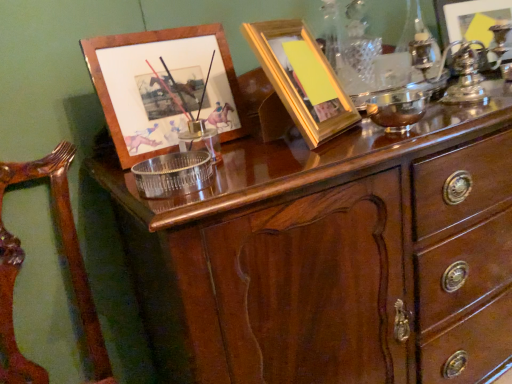
The image size is (512, 384). Describe the element at coordinates (470, 19) in the screenshot. I see `metallic silver picture frame at upper right, which is counted as the 1th picture frame, starting from the back` at that location.

Measure the distance between mahogany wood chest of drawers at upper center and camera.

21.05 inches.

Identify the location of wooden picture frame at upper left, positioned as the 1th picture frame in left-to-right order. The width and height of the screenshot is (512, 384). (163, 87).

What is the approximate height of wooden picture frame at upper left, positioned as the 1th picture frame in left-to-right order?

wooden picture frame at upper left, positioned as the 1th picture frame in left-to-right order, is 9.59 inches in height.

What do you see at coordinates (67, 265) in the screenshot? I see `wooden armchair at left` at bounding box center [67, 265].

You are a GUI agent. You are given a task and a screenshot of the screen. Output one action in this format:
    pyautogui.click(x=<x>, y=<y>)
    Task: Click on the metallic silver picture frame at upper right, acting as the 3th picture frame starting from the left
    
    Given the screenshot: What is the action you would take?
    pyautogui.click(x=470, y=19)

Is wooden picture frame at upper left, which appears as the 2th picture frame when viewed from the back, far away from yellow matte picture frame at upper center, which is counted as the second picture frame, starting from the left?

No, wooden picture frame at upper left, which appears as the 2th picture frame when viewed from the back, is not far away from yellow matte picture frame at upper center, which is counted as the second picture frame, starting from the left.

Can you confirm if wooden picture frame at upper left, which appears as the 2th picture frame when viewed from the back, is bigger than yellow matte picture frame at upper center, which is the 3th picture frame from back to front?

No.

Considering the positions of point (220, 35) and point (296, 96), is point (220, 35) closer or farther from the camera than point (296, 96)?

Point (220, 35) is farther from the camera than point (296, 96).

I want to click on picture frame on the left side of yellow matte picture frame at upper center, which is the 3th picture frame from back to front, so click(163, 87).

Considering the positions of objects yellow matte picture frame at upper center, which is the 3th picture frame from back to front, and mahogany wood chest of drawers at upper center in the image provided, who is more to the left, yellow matte picture frame at upper center, which is the 3th picture frame from back to front, or mahogany wood chest of drawers at upper center?

From the viewer's perspective, yellow matte picture frame at upper center, which is the 3th picture frame from back to front, appears more on the left side.

From the image's perspective, is yellow matte picture frame at upper center, which is the 3th picture frame from back to front, located above or below mahogany wood chest of drawers at upper center?

Based on their image positions, yellow matte picture frame at upper center, which is the 3th picture frame from back to front, is located above mahogany wood chest of drawers at upper center.

From a real-world perspective, is yellow matte picture frame at upper center, the 1th picture frame when ordered from front to back, on mahogany wood chest of drawers at upper center?

Yes, from a real-world perspective, yellow matte picture frame at upper center, the 1th picture frame when ordered from front to back, is on top of mahogany wood chest of drawers at upper center.

Can you confirm if yellow matte picture frame at upper center, the 2th picture frame from the right, is taller than mahogany wood chest of drawers at upper center?

No.

Does point (6, 320) come behind point (315, 41)?

No.

In the scene shown: Is wooden armchair at left placed right next to yellow matte picture frame at upper center, which is the 3th picture frame from back to front?

They are not placed beside each other.

From the image's perspective, is wooden armchair at left located beneath yellow matte picture frame at upper center, which is the 3th picture frame from back to front?

Yes, from the image's perspective, wooden armchair at left is beneath yellow matte picture frame at upper center, which is the 3th picture frame from back to front.

Is wooden picture frame at upper left, which appears as the third picture frame when viewed from the right, oriented away from wooden armchair at left?

That's not correct — wooden picture frame at upper left, which appears as the third picture frame when viewed from the right, is not looking away from wooden armchair at left.

Is wooden picture frame at upper left, which appears as the third picture frame when viewed from the right, positioned far away from wooden armchair at left?

No, wooden picture frame at upper left, which appears as the third picture frame when viewed from the right, is in close proximity to wooden armchair at left.

Where is `picture frame that is the 1st one when counting upward from the wooden armchair at left (from the image's perspective)`? This screenshot has height=384, width=512. picture frame that is the 1st one when counting upward from the wooden armchair at left (from the image's perspective) is located at coordinates (163, 87).

Does wooden armchair at left turn towards metallic silver picture frame at upper right, positioned as the third picture frame in front-to-back order?

No, wooden armchair at left is not turned towards metallic silver picture frame at upper right, positioned as the third picture frame in front-to-back order.

Which object is more forward, wooden armchair at left or metallic silver picture frame at upper right, the 1th picture frame viewed from the right?

wooden armchair at left.

Is wooden armchair at left at the left side of metallic silver picture frame at upper right, acting as the 3th picture frame starting from the left?

Correct, you'll find wooden armchair at left to the left of metallic silver picture frame at upper right, acting as the 3th picture frame starting from the left.

From the image's perspective, is wooden armchair at left positioned above or below metallic silver picture frame at upper right, acting as the 3th picture frame starting from the left?

Based on their image positions, wooden armchair at left is located beneath metallic silver picture frame at upper right, acting as the 3th picture frame starting from the left.

From the image's perspective, would you say metallic silver picture frame at upper right, positioned as the third picture frame in front-to-back order, is positioned over wooden armchair at left?

Yes, from the image's perspective, metallic silver picture frame at upper right, positioned as the third picture frame in front-to-back order, is over wooden armchair at left.

Would you consider metallic silver picture frame at upper right, acting as the 3th picture frame starting from the left, to be distant from wooden armchair at left?

metallic silver picture frame at upper right, acting as the 3th picture frame starting from the left, is far away from wooden armchair at left.

Which of these two, metallic silver picture frame at upper right, which is counted as the 1th picture frame, starting from the back, or wooden armchair at left, is thinner?

metallic silver picture frame at upper right, which is counted as the 1th picture frame, starting from the back, is thinner.

Is metallic silver picture frame at upper right, acting as the 3th picture frame starting from the left, taller than wooden armchair at left?

Incorrect, the height of metallic silver picture frame at upper right, acting as the 3th picture frame starting from the left, is not larger of that of wooden armchair at left.

Is yellow matte picture frame at upper center, the 2th picture frame from the right, in contact with wooden armchair at left?

yellow matte picture frame at upper center, the 2th picture frame from the right, and wooden armchair at left are clearly separated.

From the image's perspective, which object appears higher, yellow matte picture frame at upper center, which is the 3th picture frame from back to front, or wooden armchair at left?

yellow matte picture frame at upper center, which is the 3th picture frame from back to front, is shown above in the image.

What's the angular difference between yellow matte picture frame at upper center, the 1th picture frame when ordered from front to back, and wooden armchair at left's facing directions?

23.9 degrees.

Which picture frame is the 2nd one when counting from the right side of the wooden armchair at left? Please provide its 2D coordinates.

[(302, 79)]

At what (x,y) coordinates should I click in order to perform the action: click on picture frame below the yellow matte picture frame at upper center, which is counted as the second picture frame, starting from the left (from the image's perspective). Please return your answer as a coordinate pair (x, y). This screenshot has height=384, width=512. Looking at the image, I should click on (163, 87).

This screenshot has width=512, height=384. In order to click on chest of drawers located on the right of yellow matte picture frame at upper center, which is the 3th picture frame from back to front in this screenshot , I will do `click(334, 256)`.

From the image, which object appears to be farther from metallic silver picture frame at upper right, acting as the 3th picture frame starting from the left, wooden armchair at left or wooden picture frame at upper left, which appears as the 2th picture frame when viewed from the back?

The object further to metallic silver picture frame at upper right, acting as the 3th picture frame starting from the left, is wooden armchair at left.

Looking at the image, which one is located closer to yellow matte picture frame at upper center, the 2th picture frame from the right, wooden picture frame at upper left, positioned as the 1th picture frame in left-to-right order, or wooden armchair at left?

The object closer to yellow matte picture frame at upper center, the 2th picture frame from the right, is wooden picture frame at upper left, positioned as the 1th picture frame in left-to-right order.

From the image, which object appears to be farther from metallic silver picture frame at upper right, which is counted as the 1th picture frame, starting from the back, yellow matte picture frame at upper center, the 1th picture frame when ordered from front to back, or wooden armchair at left?

The object further to metallic silver picture frame at upper right, which is counted as the 1th picture frame, starting from the back, is wooden armchair at left.

Based on their spatial positions, is wooden armchair at left or metallic silver picture frame at upper right, which is counted as the 1th picture frame, starting from the back, further from yellow matte picture frame at upper center, the 1th picture frame when ordered from front to back?

The object further to yellow matte picture frame at upper center, the 1th picture frame when ordered from front to back, is metallic silver picture frame at upper right, which is counted as the 1th picture frame, starting from the back.

When comparing their distances from yellow matte picture frame at upper center, which is the 3th picture frame from back to front, does metallic silver picture frame at upper right, positioned as the third picture frame in front-to-back order, or wooden armchair at left seem further?

metallic silver picture frame at upper right, positioned as the third picture frame in front-to-back order, lies further to yellow matte picture frame at upper center, which is the 3th picture frame from back to front, than the other object.

Estimate the real-world distances between objects in this image. Which object is closer to metallic silver picture frame at upper right, positioned as the third picture frame in front-to-back order, yellow matte picture frame at upper center, which is counted as the second picture frame, starting from the left, or wooden picture frame at upper left, which appears as the third picture frame when viewed from the right?

The object closer to metallic silver picture frame at upper right, positioned as the third picture frame in front-to-back order, is yellow matte picture frame at upper center, which is counted as the second picture frame, starting from the left.

Considering their positions, is wooden armchair at left positioned closer to metallic silver picture frame at upper right, the 1th picture frame viewed from the right, than yellow matte picture frame at upper center, the 1th picture frame when ordered from front to back?

yellow matte picture frame at upper center, the 1th picture frame when ordered from front to back.

Looking at the image, which one is located closer to mahogany wood chest of drawers at upper center, wooden armchair at left or wooden picture frame at upper left, placed as the 2th picture frame when sorted from front to back?

Based on the image, wooden picture frame at upper left, placed as the 2th picture frame when sorted from front to back, appears to be nearer to mahogany wood chest of drawers at upper center.

Locate an element on the screen. The height and width of the screenshot is (384, 512). picture frame between wooden picture frame at upper left, positioned as the 1th picture frame in left-to-right order, and metallic silver picture frame at upper right, positioned as the third picture frame in front-to-back order, in the horizontal direction is located at coordinates (302, 79).

This screenshot has height=384, width=512. Identify the location of chest of drawers between wooden picture frame at upper left, positioned as the 1th picture frame in left-to-right order, and metallic silver picture frame at upper right, acting as the 3th picture frame starting from the left, in the horizontal direction. (334, 256).

Where is `chest of drawers between wooden armchair at left and metallic silver picture frame at upper right, the 1th picture frame viewed from the right, in the horizontal direction`? This screenshot has width=512, height=384. chest of drawers between wooden armchair at left and metallic silver picture frame at upper right, the 1th picture frame viewed from the right, in the horizontal direction is located at coordinates pyautogui.click(x=334, y=256).

Find the location of a particular element. This screenshot has height=384, width=512. picture frame that lies between yellow matte picture frame at upper center, the 1th picture frame when ordered from front to back, and wooden armchair at left from top to bottom is located at coordinates (163, 87).